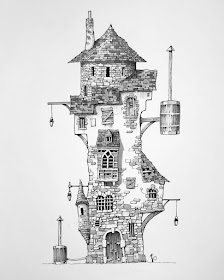
The height and width of the screenshot is (280, 224). Identify the location of door. (117, 247).